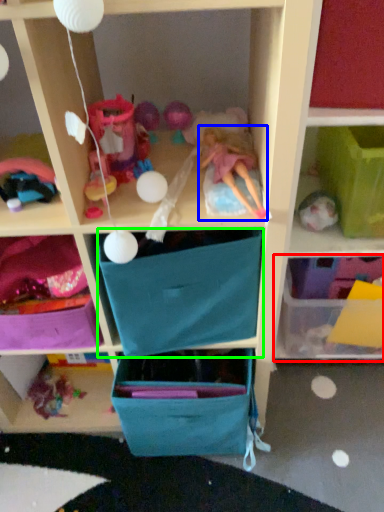
Question: Which object is positioned farthest from shelf (highlighted by a red box)? Select from doll (highlighted by a blue box) and drawer (highlighted by a green box).

Choices:
 (A) doll
 (B) drawer

Answer: (A)